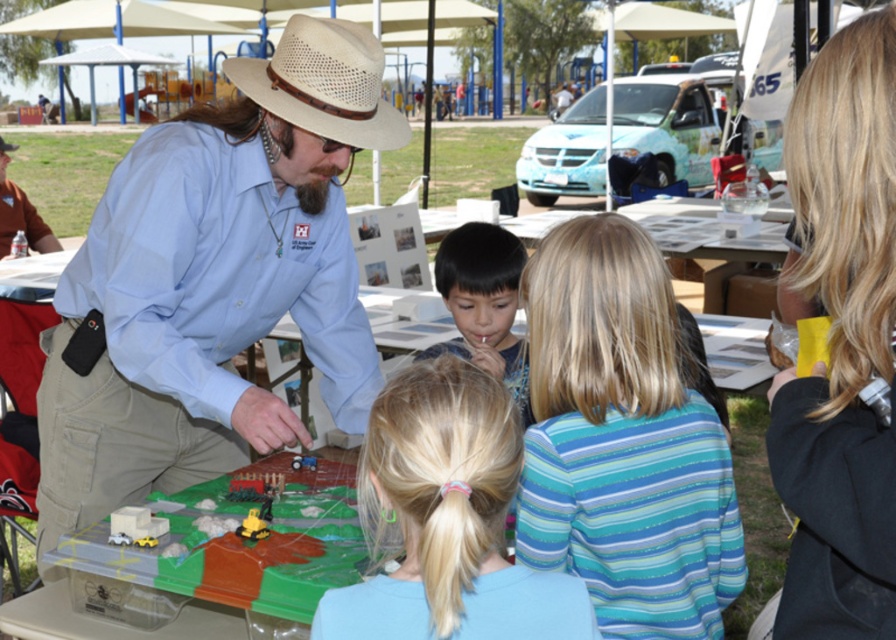
Does beige woven hat at center have a larger size compared to black matte shirt at center?

No.

Is point (312, 51) closer to camera compared to point (467, 262)?

Yes, it is.

Which is behind, point (283, 77) or point (492, 332)?

The point (492, 332) is behind.

At what (x,y) coordinates should I click in order to perform the action: click on beige woven hat at center. Please return your answer as a coordinate pair (x, y). The image size is (896, 640). Looking at the image, I should click on (325, 83).

Does light blue shirt at center appear under beige woven hat at center?

Indeed, light blue shirt at center is positioned under beige woven hat at center.

Is light blue shirt at center smaller than beige woven hat at center?

No.

Between point (177, 122) and point (328, 40), which one is positioned in front?

Point (328, 40) is in front.

Find the location of a particular element. light blue shirt at center is located at coordinates (213, 282).

The width and height of the screenshot is (896, 640). What do you see at coordinates (622, 442) in the screenshot?
I see `blue striped shirt at center` at bounding box center [622, 442].

Identify the location of blue striped shirt at center. (622, 442).